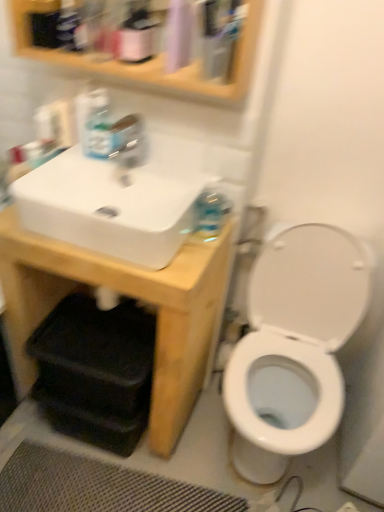
This screenshot has height=512, width=384. Find the location of `free space above black textured bath mat at lower center (from a real-world perspective)`. free space above black textured bath mat at lower center (from a real-world perspective) is located at coordinates pyautogui.click(x=96, y=475).